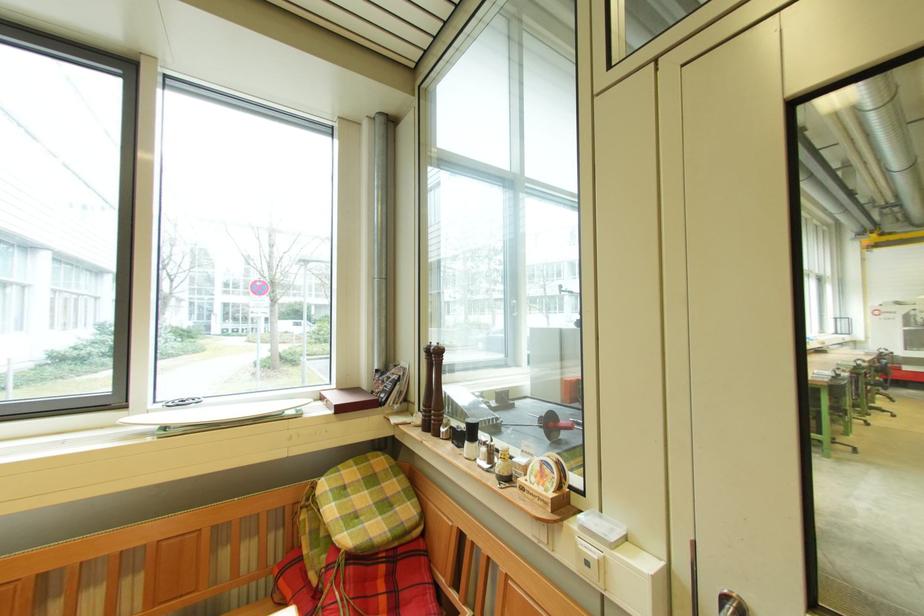
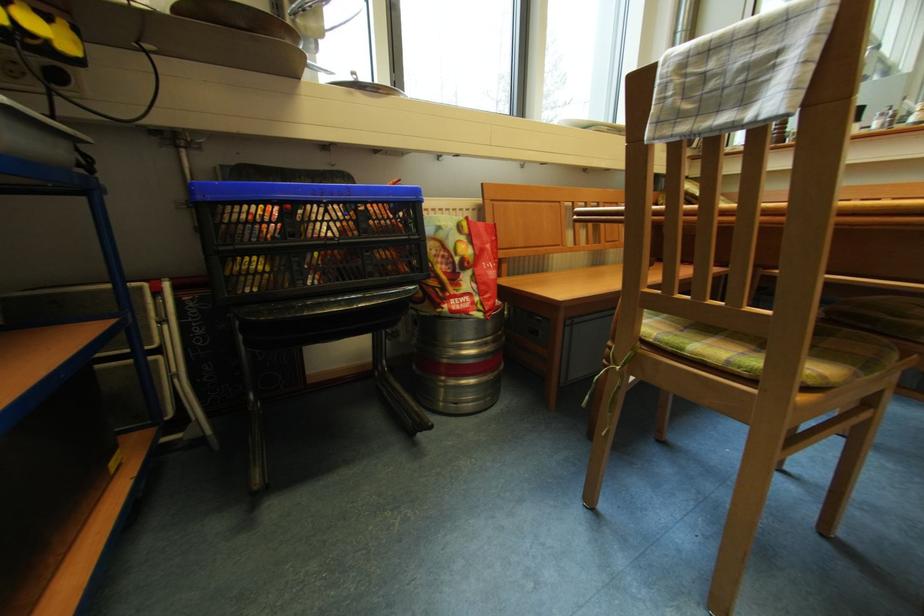
In a continuous first-person perspective shot, in which direction is the camera moving?

The cameraman walked toward left, backward.